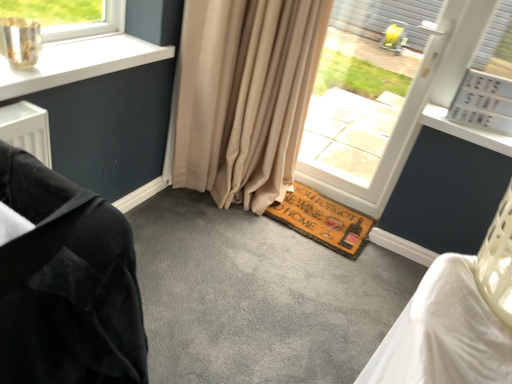
Question: Is brown coir doormat at lower center bigger or smaller than beige fabric curtain at center?

Choices:
 (A) big
 (B) small

Answer: (B)

Question: Considering the positions of point (336, 241) and point (198, 46), is point (336, 241) closer or farther from the camera than point (198, 46)?

Choices:
 (A) closer
 (B) farther

Answer: (B)

Question: Estimate the real-world distances between objects in this image. Which object is closer to the velvet black armchair at left?

Choices:
 (A) brown coir doormat at lower center
 (B) white plastic window at center
 (C) beige fabric curtain at center

Answer: (C)

Question: Which object is positioned closest to the brown coir doormat at lower center?

Choices:
 (A) velvet black armchair at left
 (B) white plastic window at center
 (C) beige fabric curtain at center

Answer: (B)